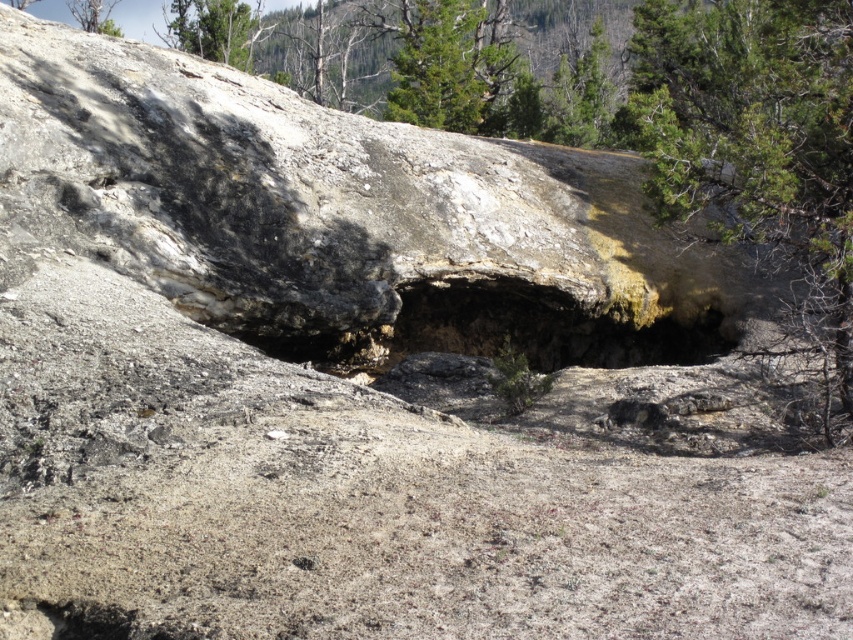
You are an explorer in this rugged outdoor scene. You want to know which object is taller between the dark rock cave at center and the green textured tree at upper center. Can you determine which one is taller?

The dark rock cave at center is not as tall as the green textured tree at upper center, so the green textured tree at upper center is taller.

You are an explorer trying to navigate through the rugged outdoor scene. You need to pass through the dark rock cave at center and the green textured tree at upper center. Which path is narrower?

The dark rock cave at center has a lesser width compared to the green textured tree at upper center, so the path through the dark rock cave at center is narrower.